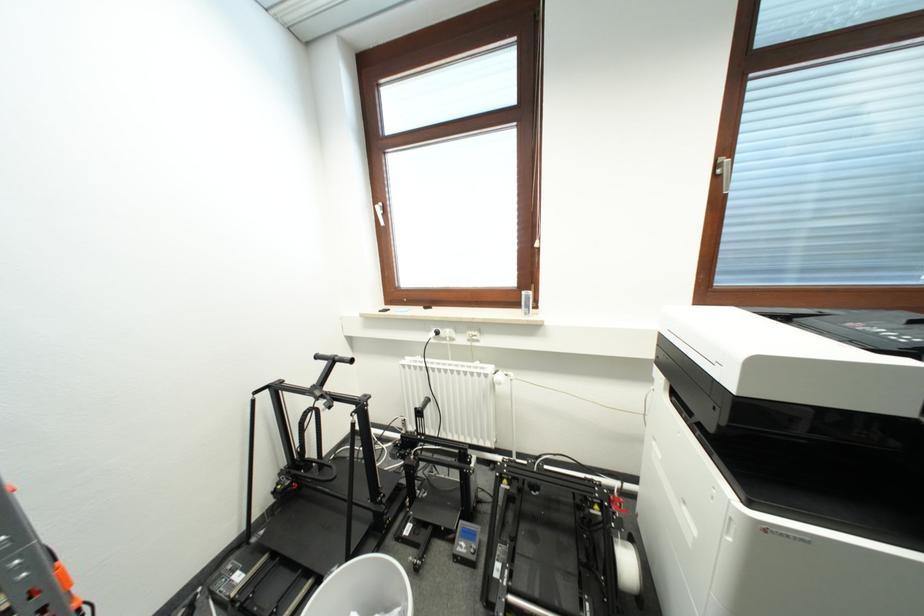
Find where to pull the silver window handle. Please return your answer as a coordinate pair (x, y).

(723, 172)